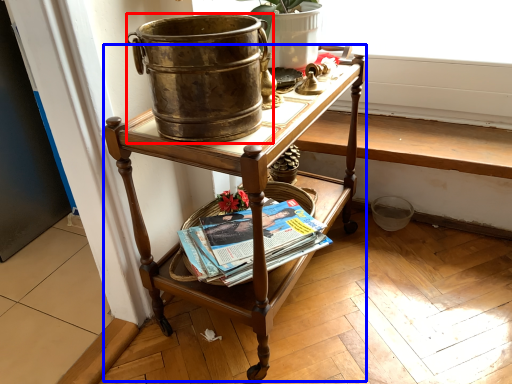
Question: Which of the following is the farthest to the observer, flowerpot (highlighted by a red box) or desk (highlighted by a blue box)?

Choices:
 (A) flowerpot
 (B) desk

Answer: (B)